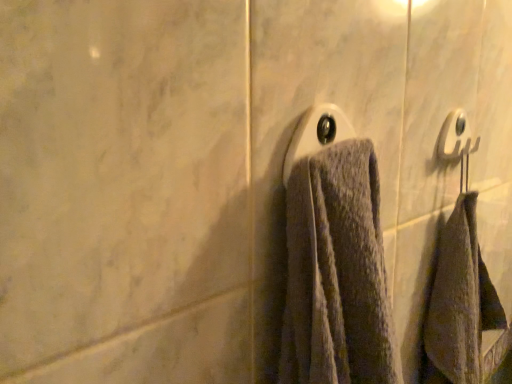
Question: Is white plastic towel bar at upper right, which appears as the 1th towel bar when viewed from the back, situated inside white plastic towel bar at center, which ranks as the first towel bar in left-to-right order, or outside?

Choices:
 (A) outside
 (B) inside

Answer: (A)

Question: Is point (460, 127) positioned closer to the camera than point (330, 142)?

Choices:
 (A) farther
 (B) closer

Answer: (A)

Question: In terms of height, does white plastic towel bar at upper right, arranged as the 2th towel bar when viewed from the left, look taller or shorter compared to white plastic towel bar at center, which ranks as the first towel bar in left-to-right order?

Choices:
 (A) short
 (B) tall

Answer: (A)

Question: Considering the positions of white plastic towel bar at center, the second towel bar when ordered from back to front, and white plastic towel bar at upper right, which appears as the 1th towel bar when viewed from the back, in the image, is white plastic towel bar at center, the second towel bar when ordered from back to front, taller or shorter than white plastic towel bar at upper right, which appears as the 1th towel bar when viewed from the back,?

Choices:
 (A) tall
 (B) short

Answer: (A)

Question: Is white plastic towel bar at center, the 1th towel bar from the front, inside or outside of white plastic towel bar at upper right, arranged as the 2th towel bar when viewed from the left?

Choices:
 (A) outside
 (B) inside

Answer: (A)

Question: Does point (307, 152) appear closer or farther from the camera than point (461, 112)?

Choices:
 (A) farther
 (B) closer

Answer: (B)

Question: In terms of size, does white plastic towel bar at center, which ranks as the second towel bar in right-to-left order, appear bigger or smaller than white plastic towel bar at upper right, which appears as the 1th towel bar when viewed from the back?

Choices:
 (A) small
 (B) big

Answer: (B)